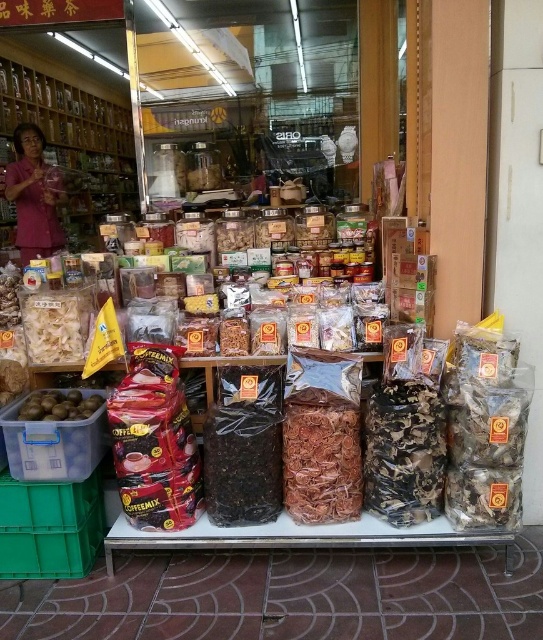
Question: Which point is closer to the camera?

Choices:
 (A) pink fabric at left
 (B) green matte fruit at lower left

Answer: (B)

Question: Can you confirm if pink fabric at left is positioned below green matte fruit at lower left?

Choices:
 (A) yes
 (B) no

Answer: (B)

Question: Which point is farther to the camera?

Choices:
 (A) (61, 403)
 (B) (34, 195)

Answer: (B)

Question: In this image, where is pink fabric at left located relative to green matte fruit at lower left?

Choices:
 (A) below
 (B) above

Answer: (B)

Question: Can you confirm if pink fabric at left is positioned above green matte fruit at lower left?

Choices:
 (A) no
 (B) yes

Answer: (B)